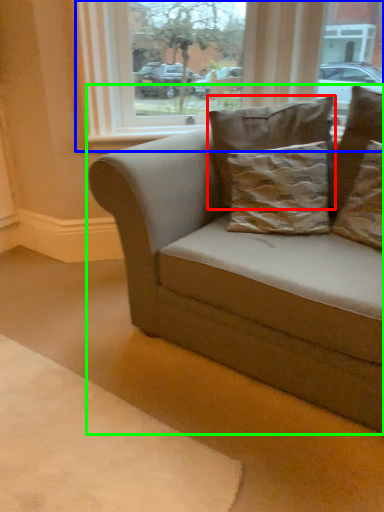
Question: Based on their relative distances, which object is farther from pillow (highlighted by a red box)? Choose from window (highlighted by a blue box) and studio couch (highlighted by a green box).

Choices:
 (A) window
 (B) studio couch

Answer: (A)